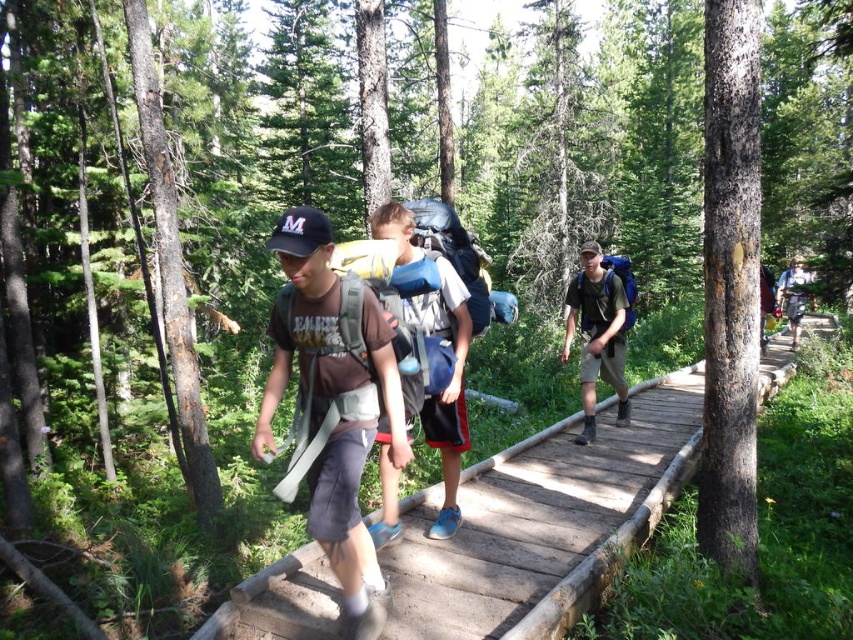
Is matte gray backpack at center shorter than matte green backpack at center?

Yes.

Locate an element on the screen. This screenshot has width=853, height=640. matte gray backpack at center is located at coordinates (332, 403).

From the picture: Does wooden bridge at center lie behind matte green backpack at center?

No, wooden bridge at center is in front of matte green backpack at center.

Between wooden bridge at center and matte green backpack at center, which one appears on the right side from the viewer's perspective?

matte green backpack at center

Does point (622, 499) lie in front of point (619, 352)?

Yes, it is in front of point (619, 352).

The image size is (853, 640). Identify the location of wooden bridge at center. (544, 518).

Is point (645, 480) positioned after point (343, 460)?

That is True.

I want to click on wooden bridge at center, so click(544, 518).

Who is more forward, (764,392) or (306,326)?

Positioned in front is point (306,326).

The image size is (853, 640). In order to click on wooden bridge at center in this screenshot , I will do `click(544, 518)`.